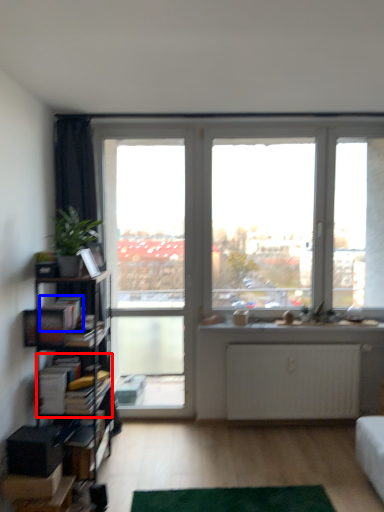
Question: Which of the following is the farthest to the observer, book (highlighted by a red box) or book (highlighted by a blue box)?

Choices:
 (A) book
 (B) book

Answer: (A)